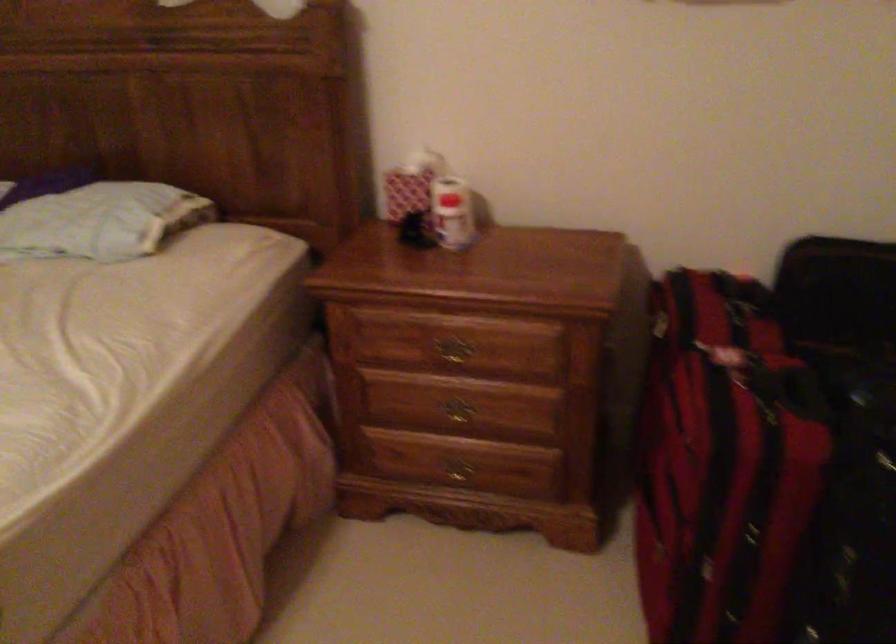
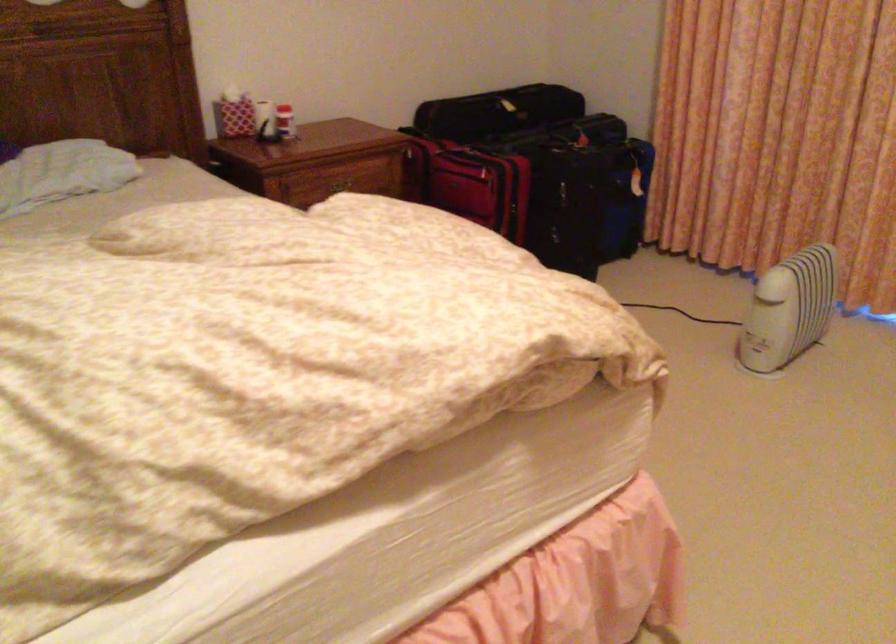
Find the pixel in the second image that matches point 457,218 in the first image.

(285, 122)